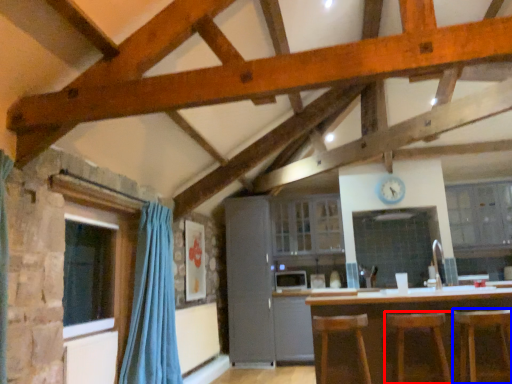
Question: Which point is closer to the camera, bar stool (highlighted by a red box) or bar stool (highlighted by a blue box)?

Choices:
 (A) bar stool
 (B) bar stool

Answer: (B)